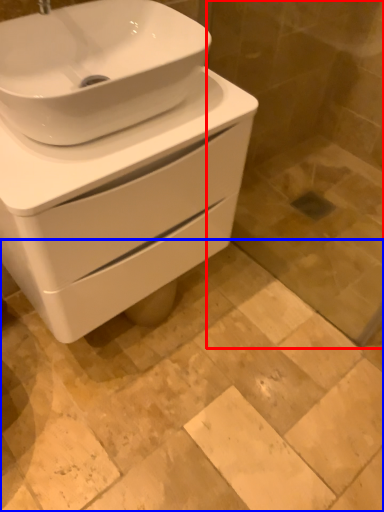
Question: Which of the following is the closest to the observer, glass door (highlighted by a red box) or ceramic tile (highlighted by a blue box)?

Choices:
 (A) glass door
 (B) ceramic tile

Answer: (A)